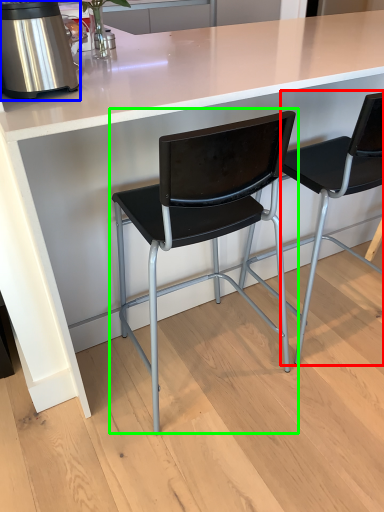
Question: Which is farther away from chair (highlighted by a red box)? kitchen appliance (highlighted by a blue box) or chair (highlighted by a green box)?

Choices:
 (A) kitchen appliance
 (B) chair

Answer: (A)